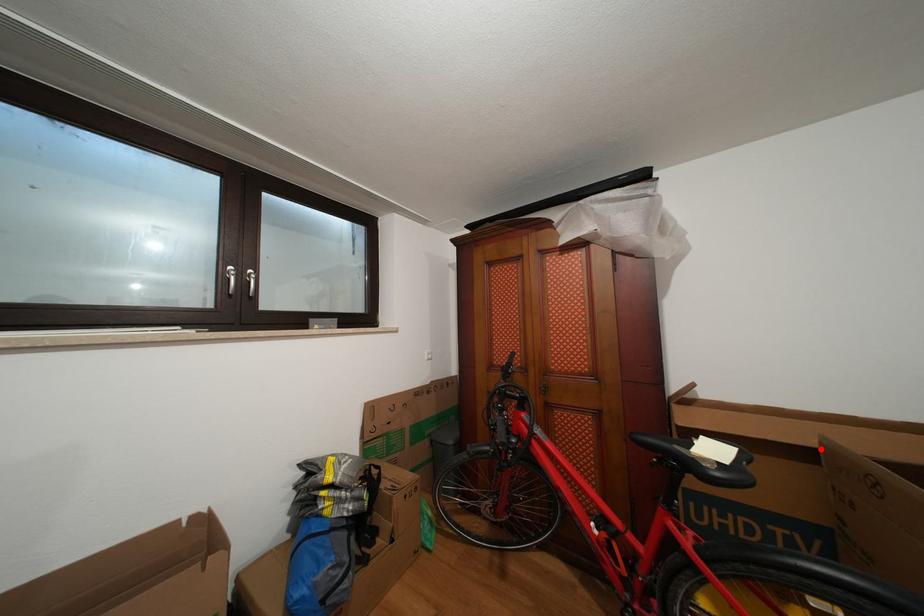
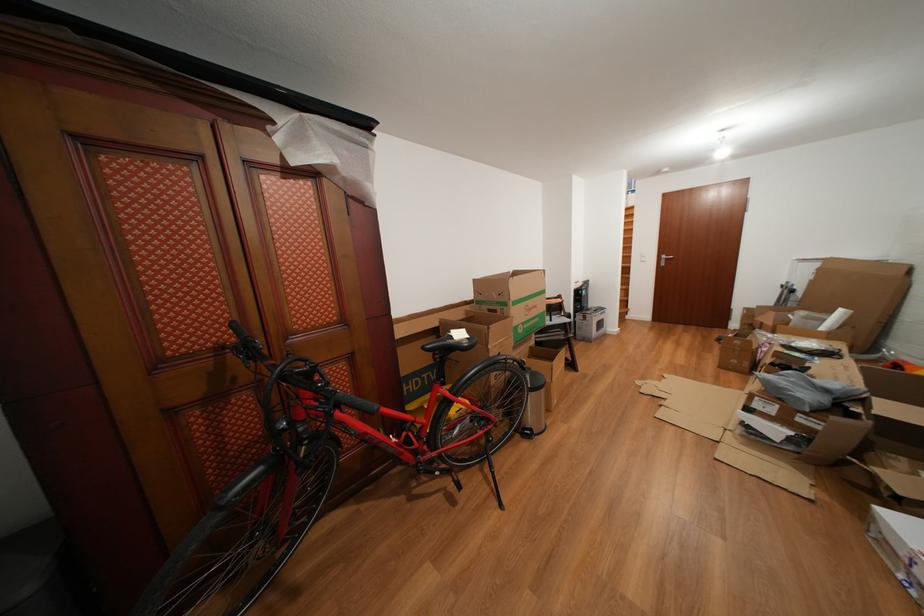
Find the pixel in the second image that matches the highlighted location in the first image.

(445, 330)